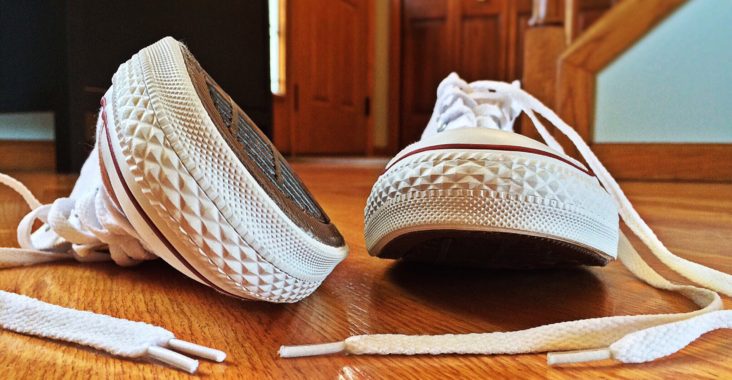
At what (x,y) coordinates should I click in order to perform the action: click on window. Please return your answer as a coordinate pair (x, y). The width and height of the screenshot is (732, 380). Looking at the image, I should click on (272, 70).